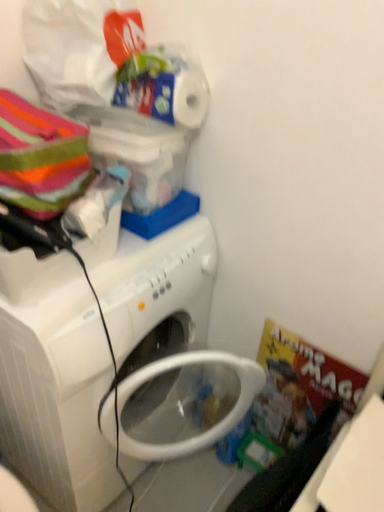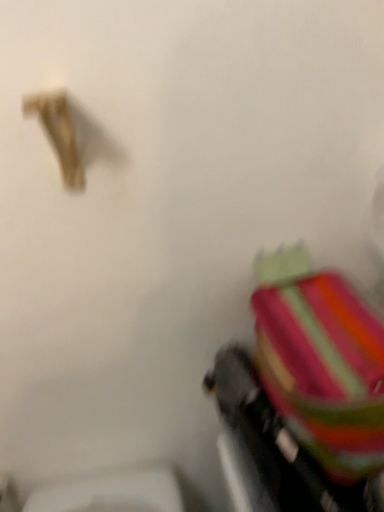
Question: Which way did the camera rotate in the video?

Choices:
 (A) rotated left
 (B) rotated right

Answer: (A)